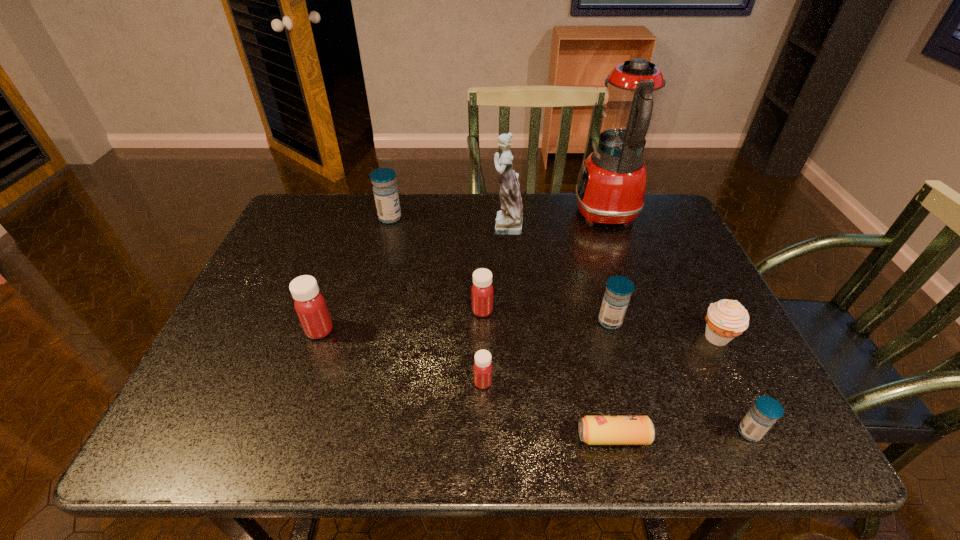
This screenshot has height=540, width=960. Identify the location of figurine that is at the far edge. (509, 221).

Locate an element on the screen. This screenshot has width=960, height=540. medicine present at the far edge is located at coordinates (385, 190).

Where is `medicine located in the near edge section of the desktop`? medicine located in the near edge section of the desktop is located at coordinates (766, 410).

Identify the location of beer can at the near edge. The height and width of the screenshot is (540, 960). (593, 430).

The image size is (960, 540). In order to click on food processor located at the right edge in this screenshot , I will do `click(611, 187)`.

What are the coordinates of `muffin located at the right edge` in the screenshot? It's located at (726, 319).

You are a GUI agent. You are given a task and a screenshot of the screen. Output one action in this format:
    pyautogui.click(x=<x>, y=<y>)
    Task: Click on the medicine that is at the right edge
    This screenshot has height=540, width=960.
    Given the screenshot: What is the action you would take?
    pyautogui.click(x=766, y=410)

The height and width of the screenshot is (540, 960). In order to click on object situated at the far right corner in this screenshot , I will do `click(611, 187)`.

Image resolution: width=960 pixels, height=540 pixels. In order to click on object present at the near right corner in this screenshot , I will do `click(766, 410)`.

I want to click on vacant position at the far edge of the desktop, so click(521, 193).